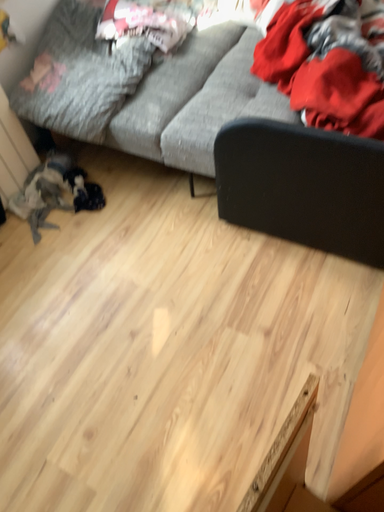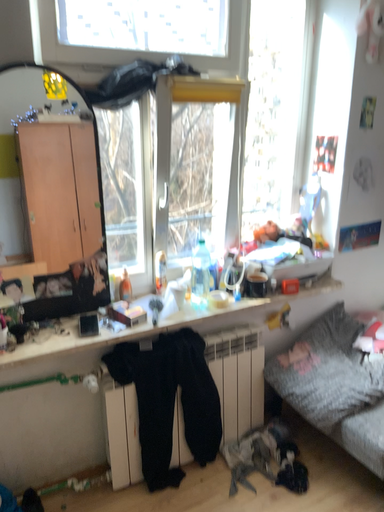
Question: How did the camera likely rotate when shooting the video?

Choices:
 (A) rotated downward
 (B) rotated upward

Answer: (B)